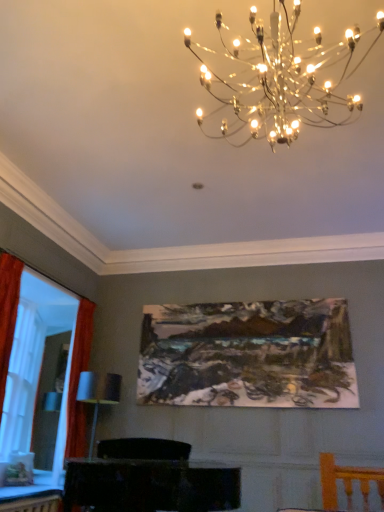
Question: Is metallic chandelier at upper center inside or outside of matte orange curtain at left?

Choices:
 (A) outside
 (B) inside

Answer: (A)

Question: Is point (208, 70) positioned closer to the camera than point (6, 315)?

Choices:
 (A) farther
 (B) closer

Answer: (B)

Question: Which object is positioned closest to the matte black cabinet at lower center?

Choices:
 (A) matte orange curtain at left
 (B) wooden table at lower left
 (C) metallic chandelier at upper center
 (D) oil painting at center

Answer: (B)

Question: Considering the real-world distances, which object is closest to the metallic chandelier at upper center?

Choices:
 (A) wooden table at lower left
 (B) matte black cabinet at lower center
 (C) matte orange curtain at left
 (D) oil painting at center

Answer: (D)